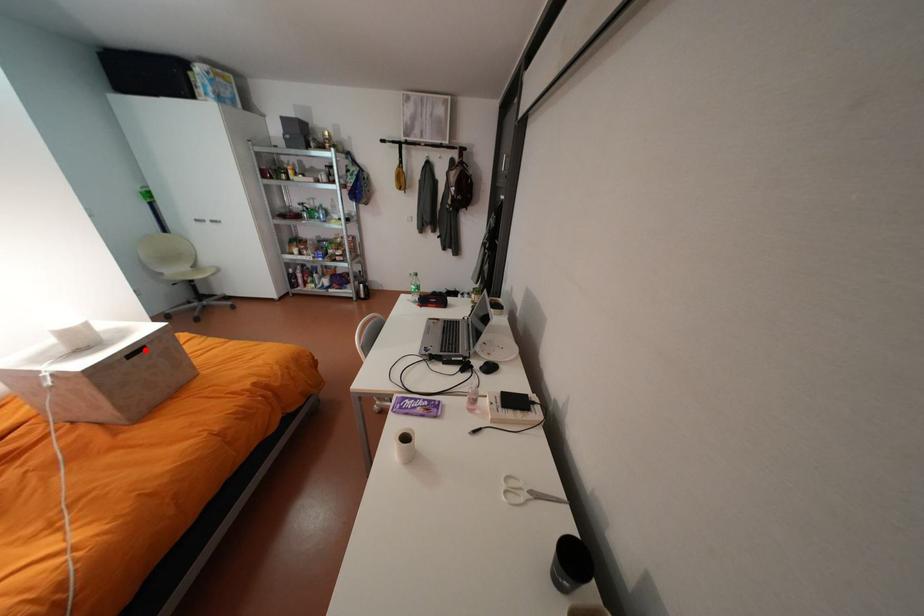
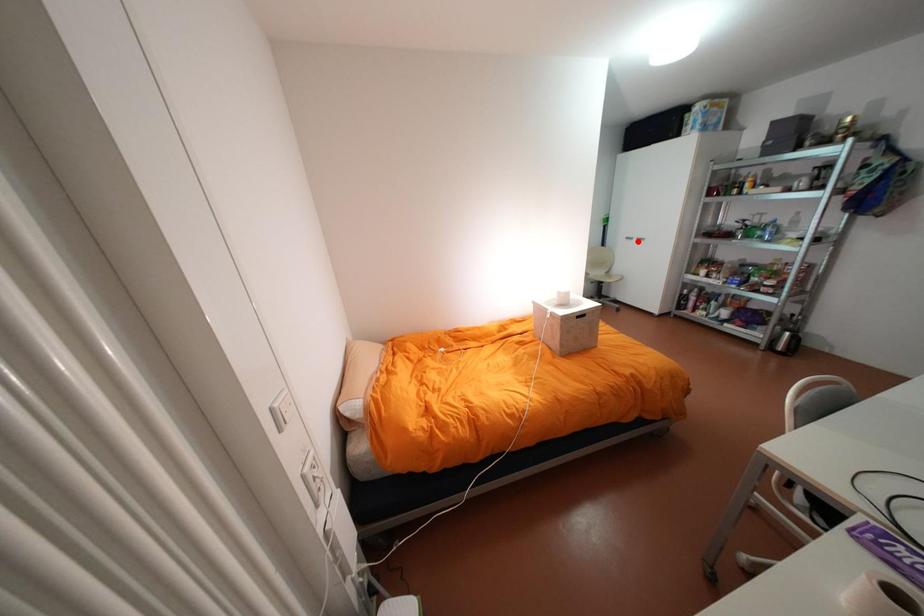
I am providing you with two images of the same scene from different viewpoints. A red point is marked on the first image and another point is marked on the second image. Do the highlighted points in image1 and image2 indicate the same real-world spot?

No